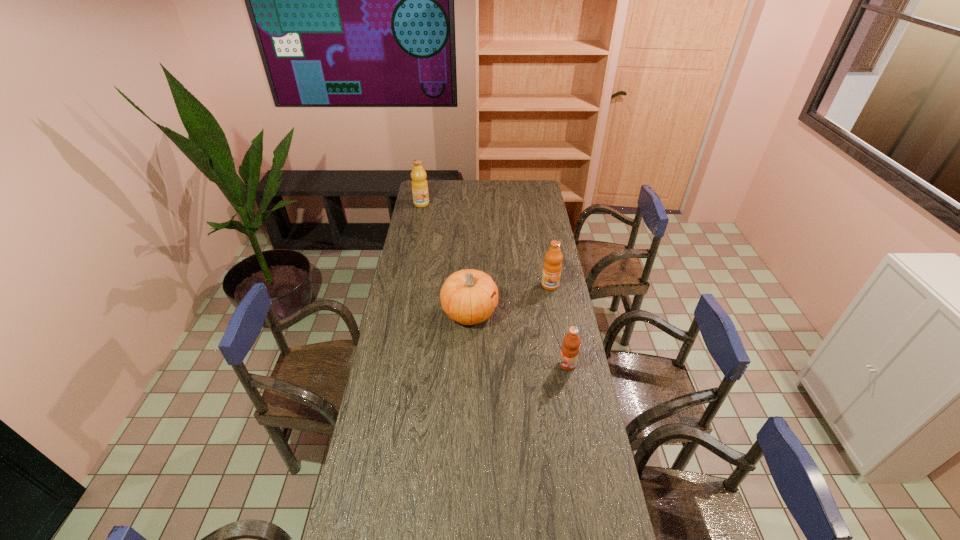
Find the location of a particular element. This screenshot has width=960, height=540. free point between the third farthest object and the leftmost fruit juice is located at coordinates (445, 259).

Locate an element on the screen. This screenshot has width=960, height=540. free space between the second farthest fruit juice and the shortest object is located at coordinates (559, 325).

You are a GUI agent. You are given a task and a screenshot of the screen. Output one action in this format:
    pyautogui.click(x=<x>, y=<y>)
    Task: Click on the empty space that is in between the farthest fruit juice and the second farthest object
    The height and width of the screenshot is (540, 960).
    Given the screenshot: What is the action you would take?
    click(486, 245)

Where is `unoccupied position between the leftmost fruit juice and the second object from left to right`? This screenshot has height=540, width=960. unoccupied position between the leftmost fruit juice and the second object from left to right is located at coordinates (445, 259).

Locate an element on the screen. The width and height of the screenshot is (960, 540). free area in between the third nearest object and the farthest object is located at coordinates (486, 245).

Locate an element on the screen. free space between the third object from right to left and the second farthest object is located at coordinates (510, 299).

The height and width of the screenshot is (540, 960). Find the location of `free space that is in between the nearest fruit juice and the second nearest fruit juice`. free space that is in between the nearest fruit juice and the second nearest fruit juice is located at coordinates (559, 325).

Image resolution: width=960 pixels, height=540 pixels. In order to click on empty location between the third farthest object and the second farthest object in this screenshot , I will do `click(510, 299)`.

The width and height of the screenshot is (960, 540). I want to click on free space between the third object from right to left and the second farthest fruit juice, so click(510, 299).

Image resolution: width=960 pixels, height=540 pixels. I want to click on the second closest object to the nearest fruit juice, so click(552, 267).